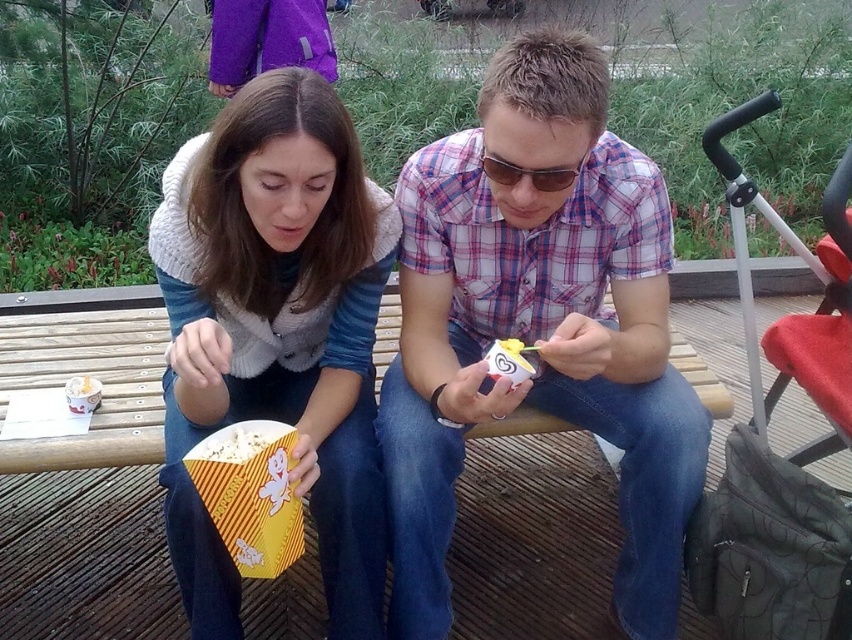
Which of these two, matte yellow popcorn box at center or metallic silver baby carriage at right, stands shorter?

metallic silver baby carriage at right is shorter.

Is matte yellow popcorn box at center shorter than metallic silver baby carriage at right?

No, matte yellow popcorn box at center is not shorter than metallic silver baby carriage at right.

The width and height of the screenshot is (852, 640). What do you see at coordinates (275, 332) in the screenshot?
I see `matte yellow popcorn box at center` at bounding box center [275, 332].

You are a GUI agent. You are given a task and a screenshot of the screen. Output one action in this format:
    pyautogui.click(x=<x>, y=<y>)
    Task: Click on the matte yellow popcorn box at center
    This screenshot has height=640, width=852.
    Given the screenshot: What is the action you would take?
    pyautogui.click(x=275, y=332)

Which of these two, plaid shirt at center or metallic silver baby carriage at right, stands shorter?

metallic silver baby carriage at right

Does plaid shirt at center appear under metallic silver baby carriage at right?

Correct, plaid shirt at center is located below metallic silver baby carriage at right.

Does point (672, 401) come closer to viewer compared to point (827, 355)?

Yes, it is.

The width and height of the screenshot is (852, 640). In order to click on plaid shirt at center in this screenshot , I will do `click(538, 323)`.

Does point (695, 448) come in front of point (223, 131)?

That is False.

You are a GUI agent. You are given a task and a screenshot of the screen. Output one action in this format:
    pyautogui.click(x=<x>, y=<y>)
    Task: Click on the plaid shirt at center
    This screenshot has width=852, height=640.
    Given the screenshot: What is the action you would take?
    pyautogui.click(x=538, y=323)